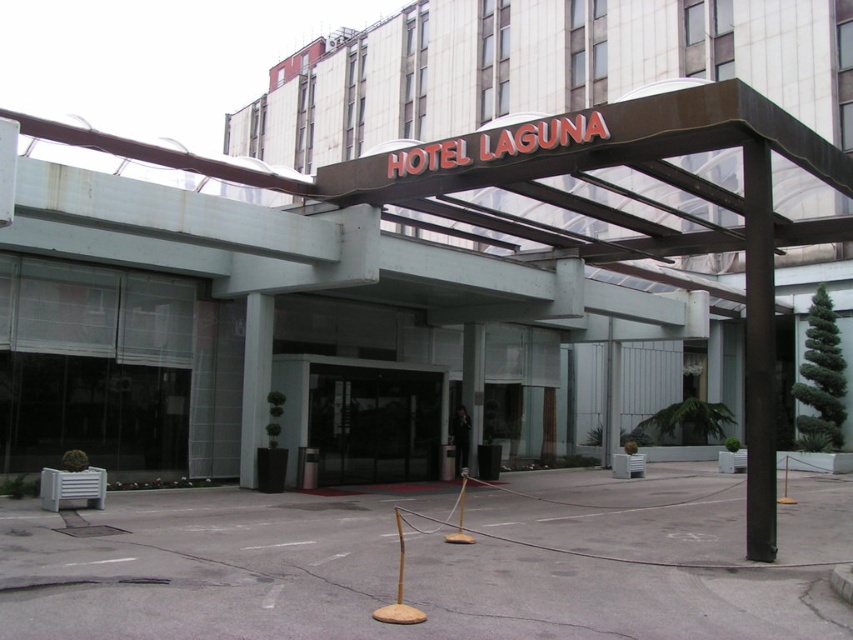
Find the location of `transparent glass door at center`. transparent glass door at center is located at coordinates coord(374,422).

What are the coordinates of `transparent glass door at center` in the screenshot? It's located at (374, 422).

Does metallic signboard at center come in front of black polished pole at center?

No.

From the picture: Is metallic signboard at center shorter than black polished pole at center?

In fact, metallic signboard at center may be taller than black polished pole at center.

Does point (325, 61) lie behind point (770, 358)?

Yes, it is behind point (770, 358).

Identify the location of metallic signboard at center. The image size is (853, 640). (540, 68).

Consider the image. Can you confirm if transparent glass door at center is positioned to the left of black polished pole at center?

Yes, transparent glass door at center is to the left of black polished pole at center.

At what (x,y) coordinates should I click in order to perform the action: click on transparent glass door at center. Please return your answer as a coordinate pair (x, y). This screenshot has width=853, height=640. Looking at the image, I should click on (374, 422).